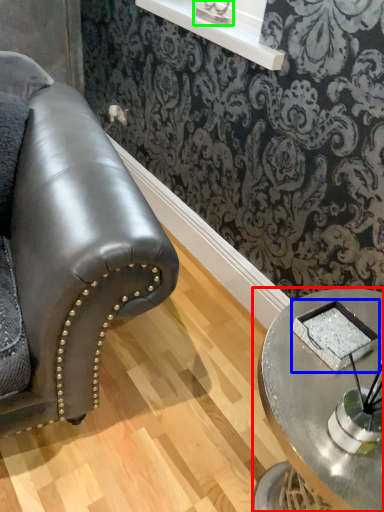
Question: Which object is the farthest from table (highlighted by a red box)? Choose among these: pad (highlighted by a blue box) or table lamp (highlighted by a green box).

Choices:
 (A) pad
 (B) table lamp

Answer: (B)